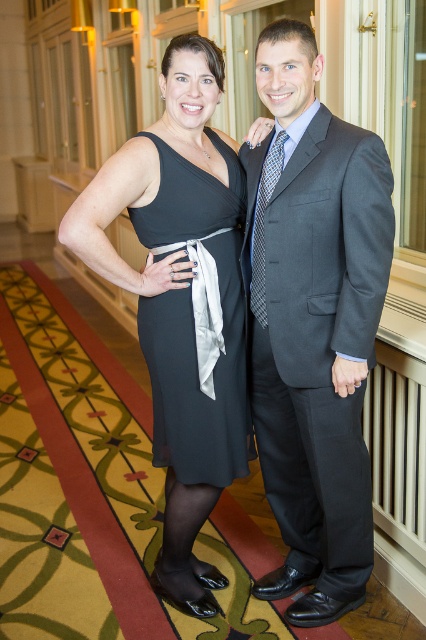
Question: Which is nearer to the dark gray suit at center?

Choices:
 (A) black chiffon dress at center
 (B) blue textured tie at center
 (C) matte black dress at center

Answer: (A)

Question: Which of the following is the closest to the observer?

Choices:
 (A) matte black dress at center
 (B) black chiffon dress at center
 (C) dark gray suit at center

Answer: (A)

Question: Is dark gray suit at center smaller than blue textured tie at center?

Choices:
 (A) yes
 (B) no

Answer: (B)

Question: Which point appears farthest from the camera in this image?

Choices:
 (A) (207, 273)
 (B) (262, 234)

Answer: (A)

Question: Can you confirm if matte black dress at center is positioned to the left of black chiffon dress at center?

Choices:
 (A) no
 (B) yes

Answer: (B)

Question: Is dark gray suit at center above matte black dress at center?

Choices:
 (A) no
 (B) yes

Answer: (B)